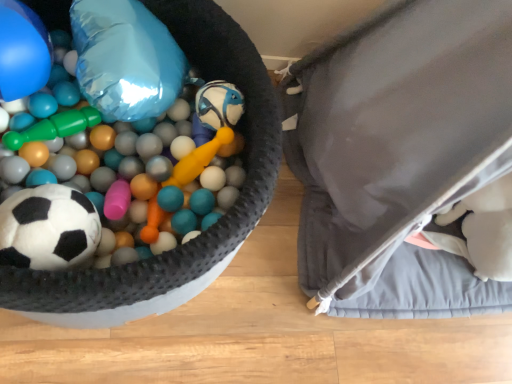
Question: From a real-world perspective, relative to blue glossy balloon at upper left, which is the first balloon in left-to-right order, is shiny metallic balloon at upper left, which is the second balloon in left-to-right order, vertically above or below?

Choices:
 (A) above
 (B) below

Answer: (B)

Question: Is shiny metallic balloon at upper left, the first balloon viewed from the right, wider or thinner than blue glossy balloon at upper left, which is the first balloon in left-to-right order?

Choices:
 (A) wide
 (B) thin

Answer: (A)

Question: Estimate the real-world distances between objects in this image. Which object is closer to the gray fabric bean bag chair at right?

Choices:
 (A) blue glossy balloon at upper left, which is the first balloon in left-to-right order
 (B) shiny metallic balloon at upper left, the first balloon viewed from the right
 (C) white matte soccer ball at left
 (D) soft plush soccer ball at left

Answer: (D)

Question: Which object is the farthest from the gray fabric bean bag chair at right?

Choices:
 (A) white matte soccer ball at left
 (B) shiny metallic balloon at upper left, which is the second balloon in left-to-right order
 (C) blue glossy balloon at upper left, which is the first balloon in left-to-right order
 (D) soft plush soccer ball at left

Answer: (C)